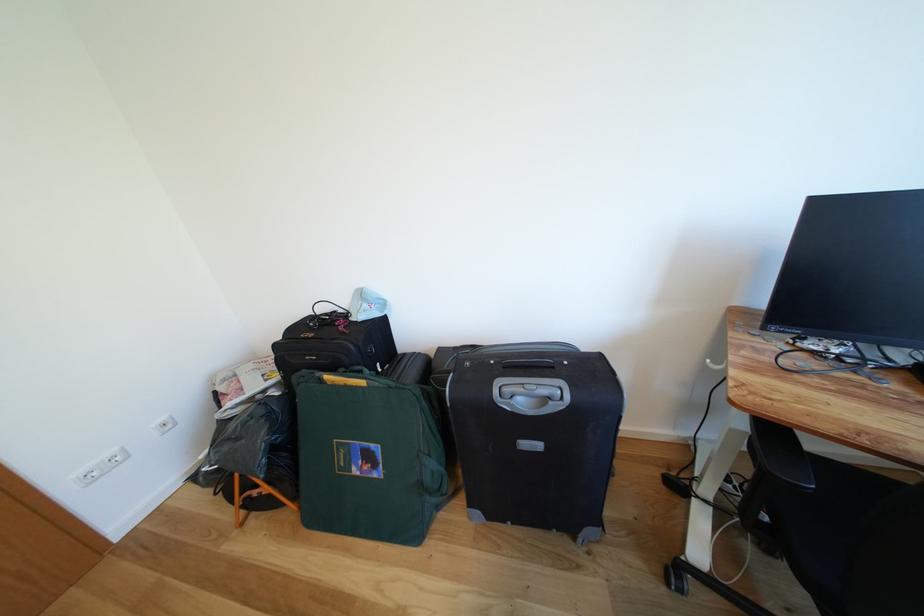
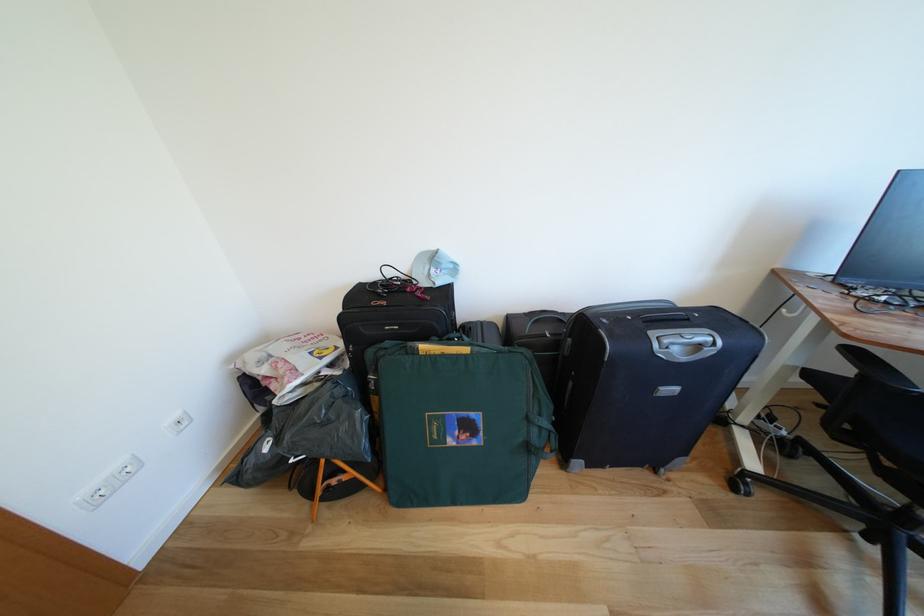
Question: What movement of the cameraman would produce the second image?

Choices:
 (A) Left
 (B) Right
 (C) Forward
 (D) Backward

Answer: (A)